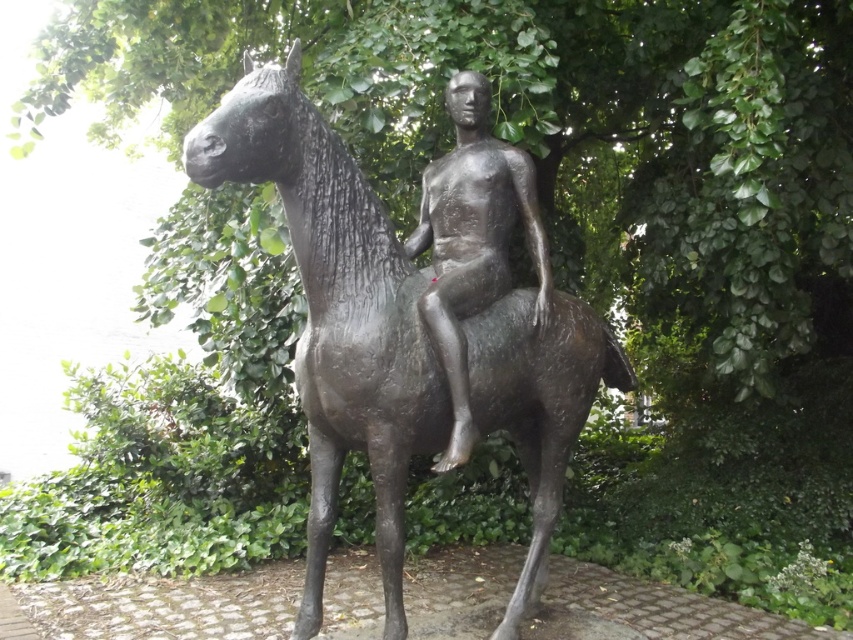
Question: Among these objects, which one is farthest from the camera?

Choices:
 (A) green leafy tree at center
 (B) bronze statue of a horse at center

Answer: (A)

Question: Is the position of green leafy tree at center less distant than that of polished bronze statue at center?

Choices:
 (A) yes
 (B) no

Answer: (B)

Question: Which object appears closest to the camera in this image?

Choices:
 (A) polished bronze statue at center
 (B) green leafy tree at center

Answer: (A)

Question: Which object appears farthest from the camera in this image?

Choices:
 (A) polished bronze statue at center
 (B) green leafy tree at center

Answer: (B)

Question: In this image, where is bronze statue of a horse at center located relative to polished bronze statue at center?

Choices:
 (A) above
 (B) below

Answer: (B)

Question: Is bronze statue of a horse at center bigger than polished bronze statue at center?

Choices:
 (A) yes
 (B) no

Answer: (A)